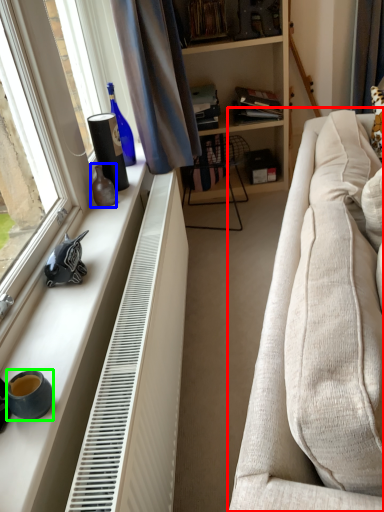
Question: Estimate the real-world distances between objects in this image. Which object is farther from studio couch (highlighted by a red box), vase (highlighted by a blue box) or coffee cup (highlighted by a green box)?

Choices:
 (A) vase
 (B) coffee cup

Answer: (A)